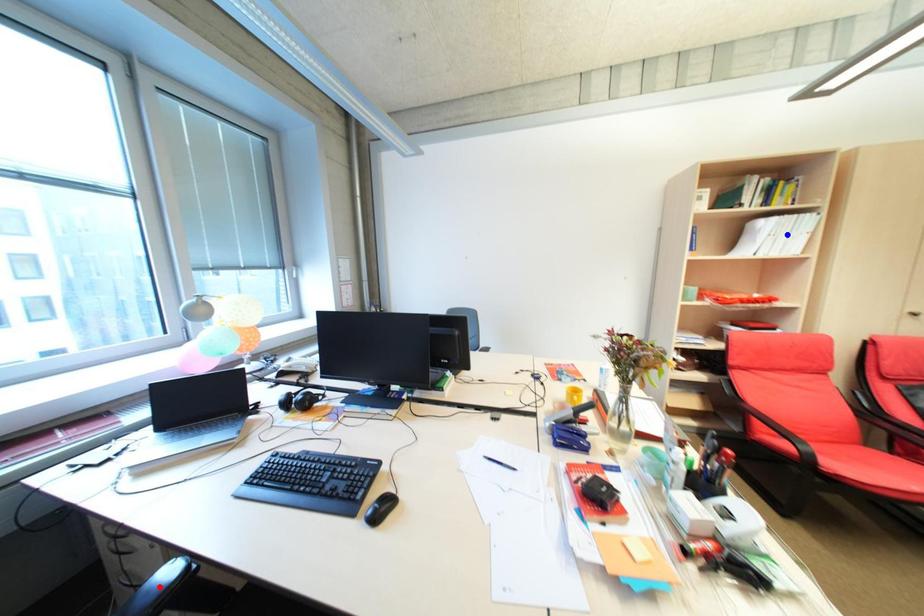
Question: In the image, two points are highlighted. Which point is nearer to the camera? Reply with the corresponding letter.

Choices:
 (A) blue point
 (B) red point

Answer: (B)